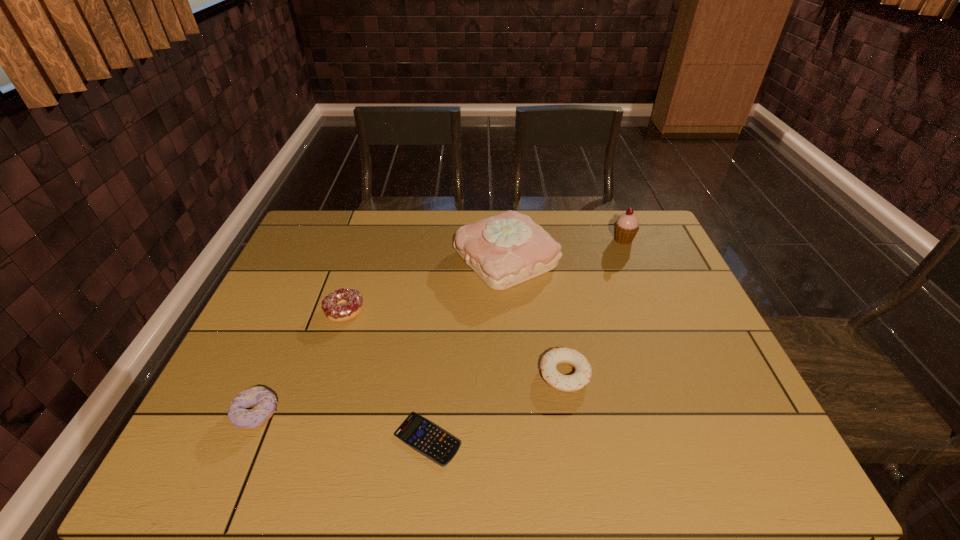
Where is `free space between the calculator and the fourth nearest object`? free space between the calculator and the fourth nearest object is located at coordinates (386, 375).

This screenshot has height=540, width=960. In order to click on free space between the leftmost object and the rightmost doughnut in this screenshot , I will do `click(411, 394)`.

Identify the location of free spot between the cake and the farthest doughnut. (425, 285).

This screenshot has height=540, width=960. What are the coordinates of `vacant space that's between the cupcake and the calculator` in the screenshot? It's located at (525, 339).

The image size is (960, 540). Find the location of `vacant area that lies between the farthest doughnut and the cake`. vacant area that lies between the farthest doughnut and the cake is located at coordinates (425, 285).

Identify the location of free space between the rightmost doughnut and the shortest object. The image size is (960, 540). (496, 407).

Identify which object is located as the nearest to the cupcake. Please provide its 2D coordinates. Your answer should be formatted as a tuple, i.e. [(x, y)], where the tuple contains the x and y coordinates of a point satisfying the conditions above.

[(504, 250)]

Select which object appears as the third closest to the farthest doughnut. Please provide its 2D coordinates. Your answer should be formatted as a tuple, i.e. [(x, y)], where the tuple contains the x and y coordinates of a point satisfying the conditions above.

[(422, 435)]

This screenshot has height=540, width=960. I want to click on doughnut that can be found as the second closest to the leftmost object, so pos(566,383).

At what (x,y) coordinates should I click in order to perform the action: click on doughnut object that ranks as the second closest to the rightmost object. Please return your answer as a coordinate pair (x, y). The width and height of the screenshot is (960, 540). Looking at the image, I should click on (352, 299).